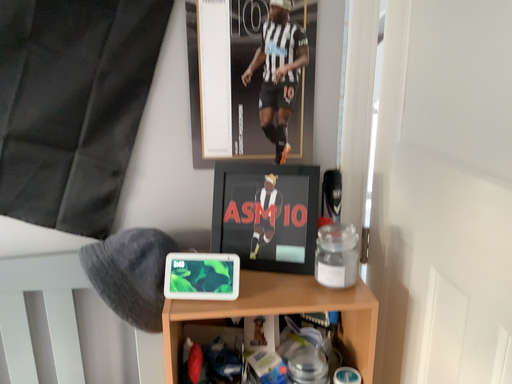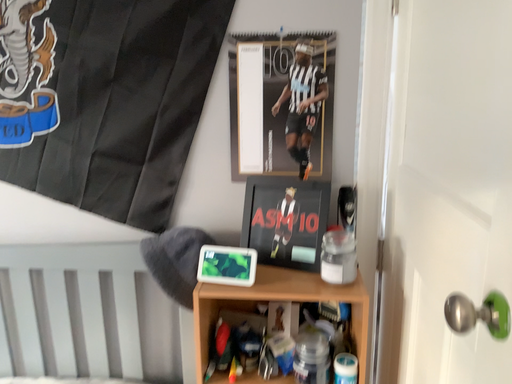
Question: How did the camera likely rotate when shooting the video?

Choices:
 (A) rotated left
 (B) rotated right

Answer: (A)